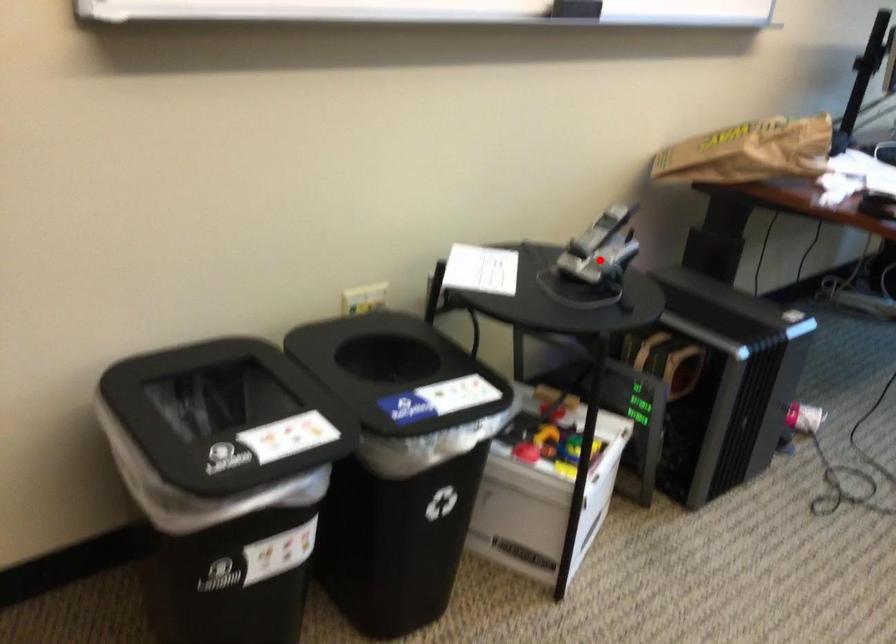
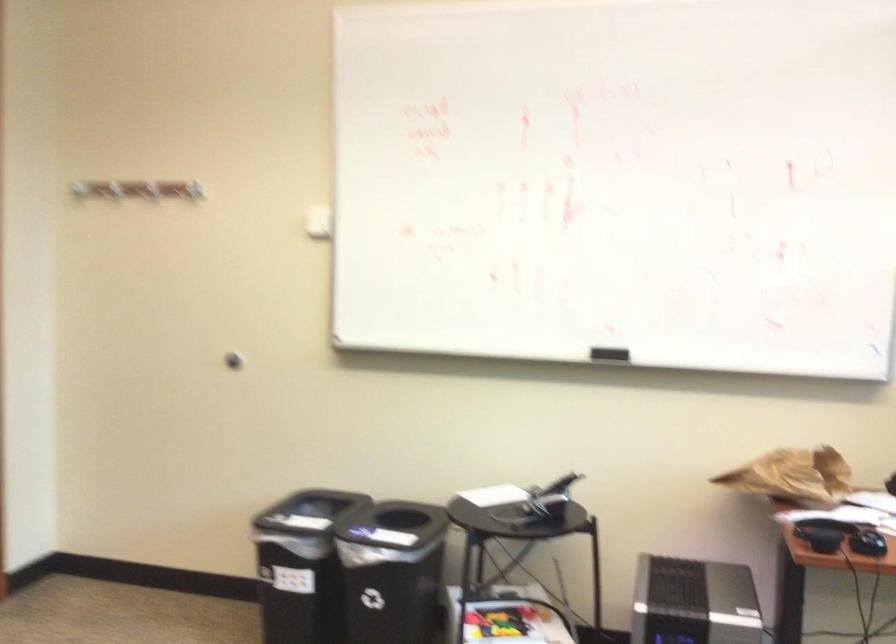
The point at the highlighted location is marked in the first image. Where is the corresponding point in the second image?

(539, 503)